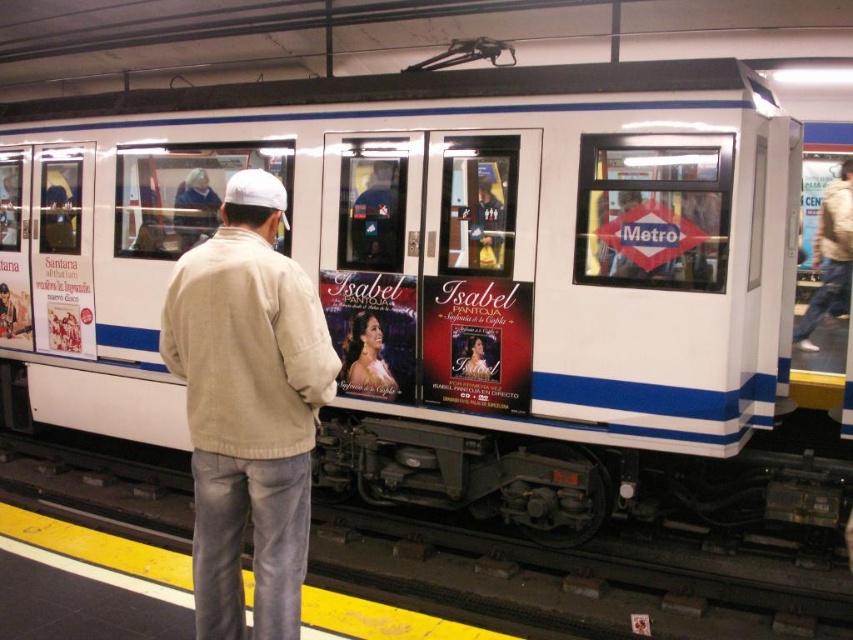
You are a photographer trying to capture the entire scene of the beige cotton jacket at center and the smooth skin woman at center in one photo. However, your camera has a limited field of view. Based on their sizes, which object should you focus on to ensure both are visible without cropping?

The beige cotton jacket at center is larger in size than the smooth skin woman at center, so focusing on the larger beige cotton jacket at center will help ensure both objects are visible within the camera frame.

You are standing at the subway station platform and want to reach the point marked at coordinates (x=212, y=540). If you are currently 2.75 meters away from this point, how many steps would it take you to walk there?

Since the point is 2.75 meters away, and an average step is about 0.75 meters, you would need approximately 4 steps to reach the point marked at coordinates (x=212, y=540).